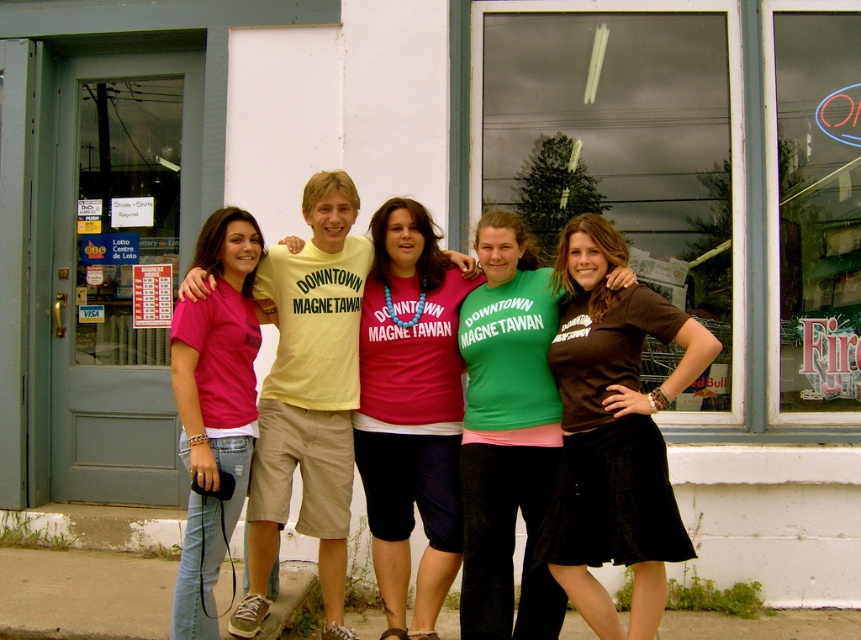
Question: Is brown cotton shirt at center positioned in front of matte pink t-shirt at left?

Choices:
 (A) yes
 (B) no

Answer: (A)

Question: Which point is closer to the camera?

Choices:
 (A) green matte shirt at center
 (B) matte pink shirt at center

Answer: (A)

Question: Among these objects, which one is nearest to the camera?

Choices:
 (A) green matte shirt at center
 (B) matte pink shirt at center
 (C) brown cotton shirt at center

Answer: (C)

Question: Considering the real-world distances, which object is closest to the green matte shirt at center?

Choices:
 (A) matte pink shirt at center
 (B) matte pink t-shirt at left

Answer: (A)

Question: Does brown cotton shirt at center have a larger size compared to green matte shirt at center?

Choices:
 (A) yes
 (B) no

Answer: (A)

Question: Does matte pink shirt at center have a greater width compared to matte pink t-shirt at left?

Choices:
 (A) no
 (B) yes

Answer: (B)